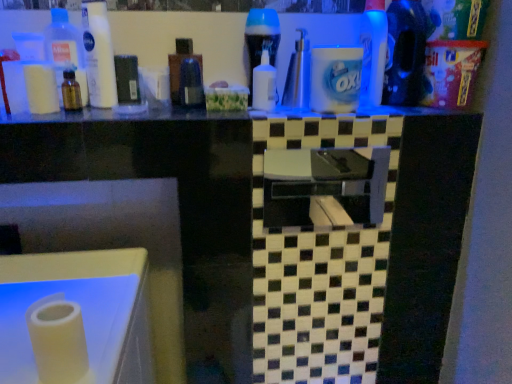
Question: Considering the positions of blue glossy bottle at upper right, the first cleaning product from the right, and blue glossy bottle at center, positioned as the third bottle in right-to-left order, in the image, is blue glossy bottle at upper right, the first cleaning product from the right, wider or thinner than blue glossy bottle at center, positioned as the third bottle in right-to-left order,?

Choices:
 (A) thin
 (B) wide

Answer: (B)

Question: Is blue glossy bottle at upper right, the first cleaning product from the right, in front of or behind blue glossy bottle at center, the fourth bottle viewed from the left, in the image?

Choices:
 (A) behind
 (B) front

Answer: (B)

Question: Which of these objects is positioned farthest from the blue glossy bottle at center, the fourth bottle viewed from the left?

Choices:
 (A) white matte lotion at upper left, marked as the third cleaning product in a right-to-left arrangement
 (B) black glossy sink at center
 (C) blue glossy bottle at upper right, which ranks as the third cleaning product in left-to-right order
 (D) brown glass bottle at left, acting as the second bottle starting from the left
 (E) white matte paper towel at lower left

Answer: (B)

Question: Which object is positioned closest to the transparent plastic bottle at center, marked as the third bottle in a left-to-right arrangement?

Choices:
 (A) transparent plastic bottle at upper left, which is the 6th bottle in right-to-left order
 (B) blue glossy bottle at center, the fourth bottle viewed from the left
 (C) white matte lotion at upper left, marked as the third cleaning product in a right-to-left arrangement
 (D) black glossy counter top at upper center
 (E) translucent plastic soap dispenser at center, which ranks as the 1th bottle in right-to-left order

Answer: (C)